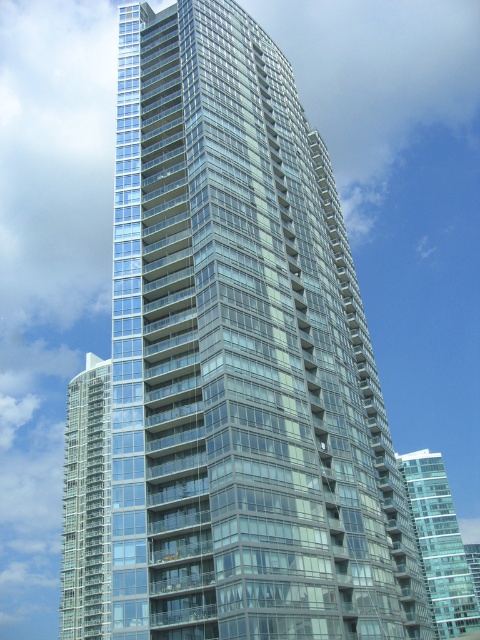
Question: In this image, where is transparent glass building at center located relative to transparent glass building at right?

Choices:
 (A) above
 (B) below

Answer: (A)

Question: Which point is farther to the camera?

Choices:
 (A) (79, 406)
 (B) (434, 609)

Answer: (B)

Question: Which object appears farthest from the camera in this image?

Choices:
 (A) transparent glass building at center
 (B) transparent glass building at right

Answer: (B)

Question: Does transparent glass building at center appear under transparent glass building at right?

Choices:
 (A) yes
 (B) no

Answer: (B)

Question: Is transparent glass building at center to the right of transparent glass building at right from the viewer's perspective?

Choices:
 (A) no
 (B) yes

Answer: (A)